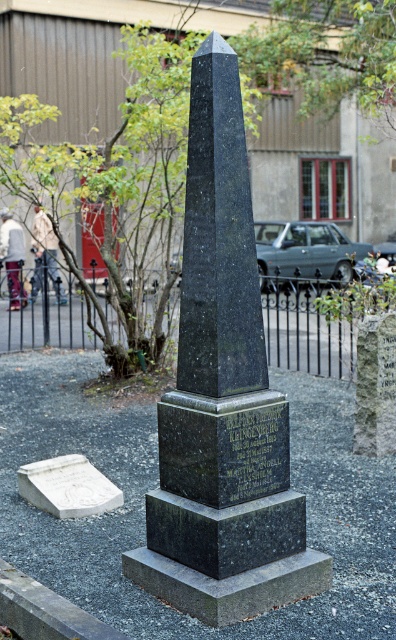
Question: Can you confirm if black granite obelisk at center is positioned to the right of white marble gravestone at lower left?

Choices:
 (A) yes
 (B) no

Answer: (A)

Question: Among these points, which one is nearest to the camera?

Choices:
 (A) (199, 563)
 (B) (104, 509)

Answer: (A)

Question: Which object is closer to the camera taking this photo?

Choices:
 (A) black granite obelisk at center
 (B) white marble gravestone at lower left

Answer: (A)

Question: Can you confirm if black granite obelisk at center is smaller than white marble gravestone at lower left?

Choices:
 (A) yes
 (B) no

Answer: (B)

Question: Is black granite obelisk at center positioned in front of white marble gravestone at lower left?

Choices:
 (A) yes
 (B) no

Answer: (A)